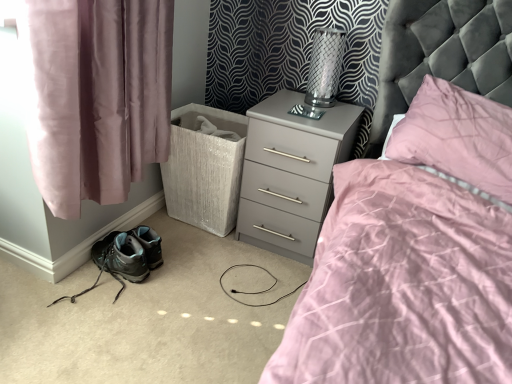
Question: Could you tell me if matte gray hiking boots at lower left is facing gray matte nightstand at center?

Choices:
 (A) no
 (B) yes

Answer: (A)

Question: Is matte gray hiking boots at lower left to the right of gray matte nightstand at center from the viewer's perspective?

Choices:
 (A) yes
 (B) no

Answer: (B)

Question: Does matte gray hiking boots at lower left have a smaller size compared to gray matte nightstand at center?

Choices:
 (A) no
 (B) yes

Answer: (B)

Question: From the image's perspective, does matte gray hiking boots at lower left appear lower than gray matte nightstand at center?

Choices:
 (A) yes
 (B) no

Answer: (A)

Question: Is matte gray hiking boots at lower left next to gray matte nightstand at center?

Choices:
 (A) no
 (B) yes

Answer: (A)

Question: Looking at the image, does metallic mesh table lamp at upper right seem bigger or smaller compared to pink satin pillow at upper right?

Choices:
 (A) big
 (B) small

Answer: (B)

Question: In terms of width, does metallic mesh table lamp at upper right look wider or thinner when compared to pink satin pillow at upper right?

Choices:
 (A) thin
 (B) wide

Answer: (A)

Question: Does point (311, 92) appear closer or farther from the camera than point (479, 109)?

Choices:
 (A) farther
 (B) closer

Answer: (A)

Question: From their relative heights in the image, would you say metallic mesh table lamp at upper right is taller or shorter than pink satin pillow at upper right?

Choices:
 (A) short
 (B) tall

Answer: (A)

Question: Is pink fabric curtain at left inside or outside of matte gray hiking boots at lower left?

Choices:
 (A) outside
 (B) inside

Answer: (A)

Question: From the image's perspective, relative to matte gray hiking boots at lower left, is pink fabric curtain at left above or below?

Choices:
 (A) above
 (B) below

Answer: (A)

Question: Would you say pink fabric curtain at left is to the left or to the right of matte gray hiking boots at lower left in the picture?

Choices:
 (A) left
 (B) right

Answer: (B)

Question: From a real-world perspective, relative to matte gray hiking boots at lower left, is pink fabric curtain at left vertically above or below?

Choices:
 (A) above
 (B) below

Answer: (A)

Question: Considering the relative positions of matte gray hiking boots at lower left and gray matte nightstand at center in the image provided, is matte gray hiking boots at lower left to the left or to the right of gray matte nightstand at center?

Choices:
 (A) right
 (B) left

Answer: (B)

Question: Is matte gray hiking boots at lower left wider or thinner than gray matte nightstand at center?

Choices:
 (A) wide
 (B) thin

Answer: (B)